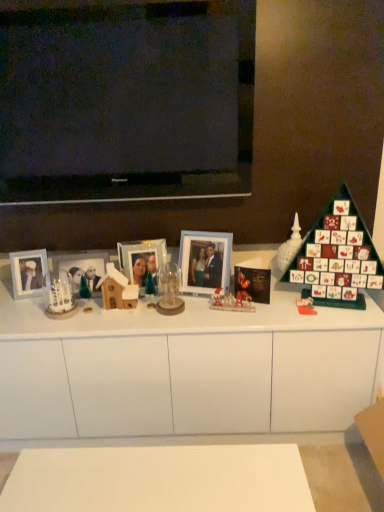
Identify the location of free space underneath green matte advent calendar at right (from a real-world perspective). This screenshot has height=512, width=384. (328, 302).